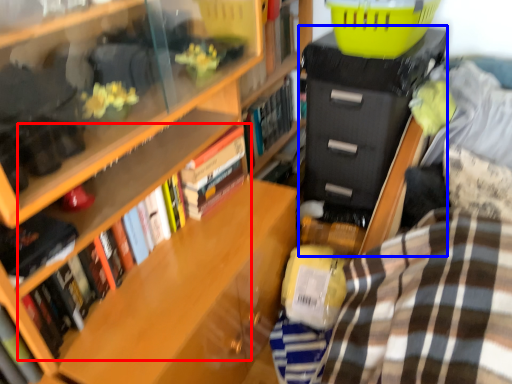
Question: Which object appears farthest to the camera in this image, book (highlighted by a red box) or file cabinet (highlighted by a blue box)?

Choices:
 (A) book
 (B) file cabinet

Answer: (B)